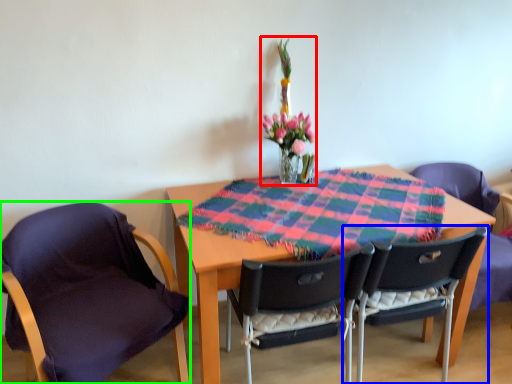
Question: Estimate the real-world distances between objects in this image. Which object is farther from floral arrangement (highlighted by a red box), chair (highlighted by a blue box) or chair (highlighted by a green box)?

Choices:
 (A) chair
 (B) chair

Answer: (B)